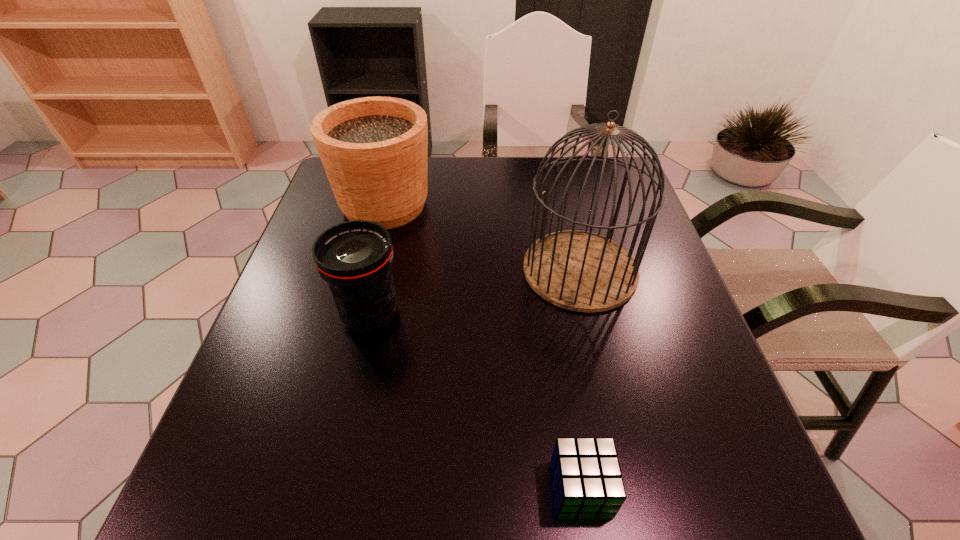
This screenshot has height=540, width=960. In order to click on vacant space situated 0.380m on the back of the nearest object in this screenshot , I will do `click(550, 291)`.

You are a GUI agent. You are given a task and a screenshot of the screen. Output one action in this format:
    pyautogui.click(x=<x>, y=<y>)
    Task: Click on the object that is at the far edge
    
    Given the screenshot: What is the action you would take?
    pyautogui.click(x=374, y=150)

Where is `object at the near edge`? object at the near edge is located at coordinates (587, 481).

Locate an element on the screen. The width and height of the screenshot is (960, 540). flowerpot that is positioned at the left edge is located at coordinates point(374,150).

This screenshot has width=960, height=540. Find the location of `telephoto lens located at the left edge`. telephoto lens located at the left edge is located at coordinates (355, 257).

Image resolution: width=960 pixels, height=540 pixels. What are the coordinates of `object that is positioned at the right edge` in the screenshot? It's located at (581, 271).

At what (x,y) coordinates should I click in order to perform the action: click on object that is at the far left corner. Please return your answer as a coordinate pair (x, y). This screenshot has height=540, width=960. Looking at the image, I should click on (374, 150).

This screenshot has width=960, height=540. In order to click on vacant space at the far edge in this screenshot , I will do `click(503, 193)`.

In order to click on free space at the near edge of the desktop in this screenshot , I will do click(514, 485).

Image resolution: width=960 pixels, height=540 pixels. Find the location of `free space at the left edge of the desktop`. free space at the left edge of the desktop is located at coordinates (252, 462).